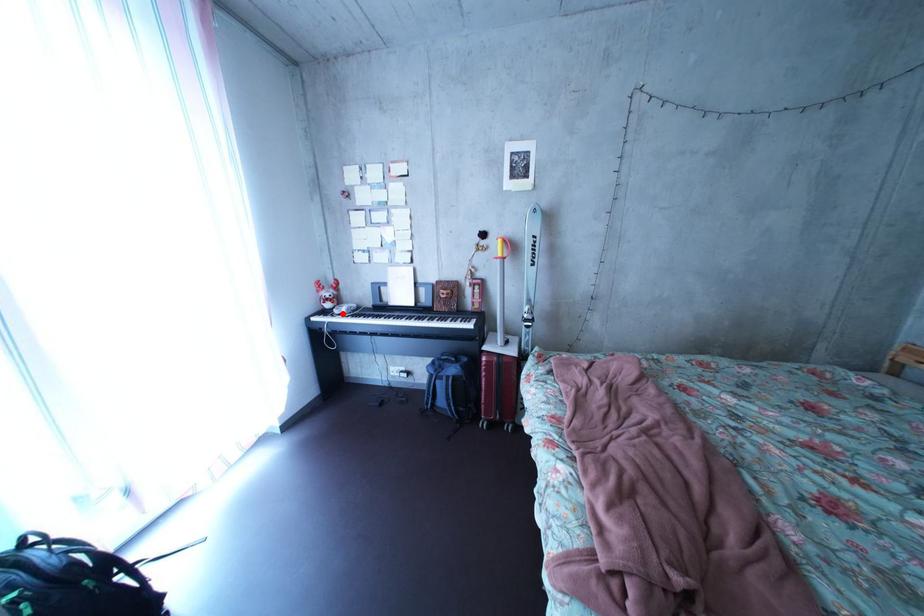
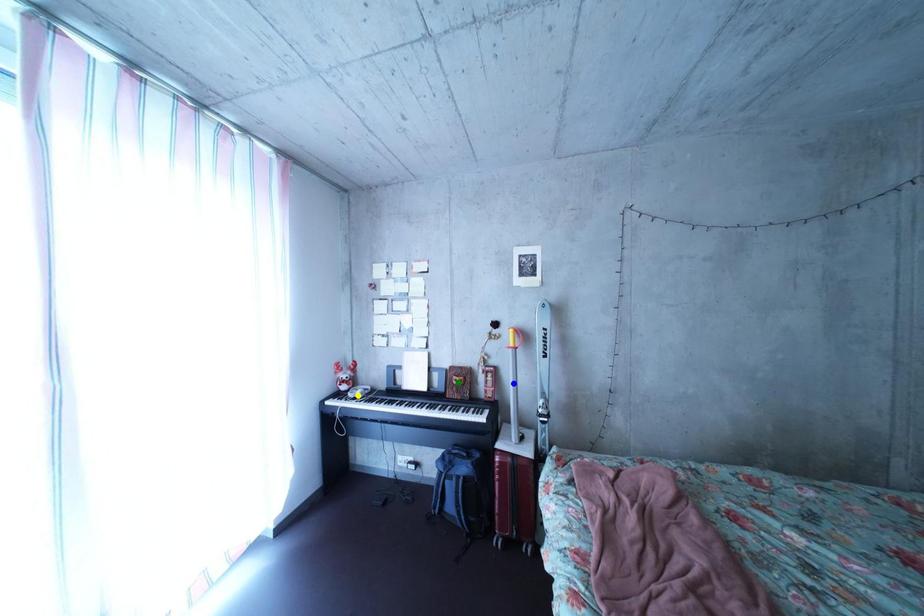
Question: I am providing you with two images of the same scene from different viewpoints. A red point is marked on the first image. You are given multiple points on the second image. In image 2, which mark is for the same physical point as the one in image 1?

Choices:
 (A) green point
 (B) yellow point
 (C) blue point

Answer: (B)